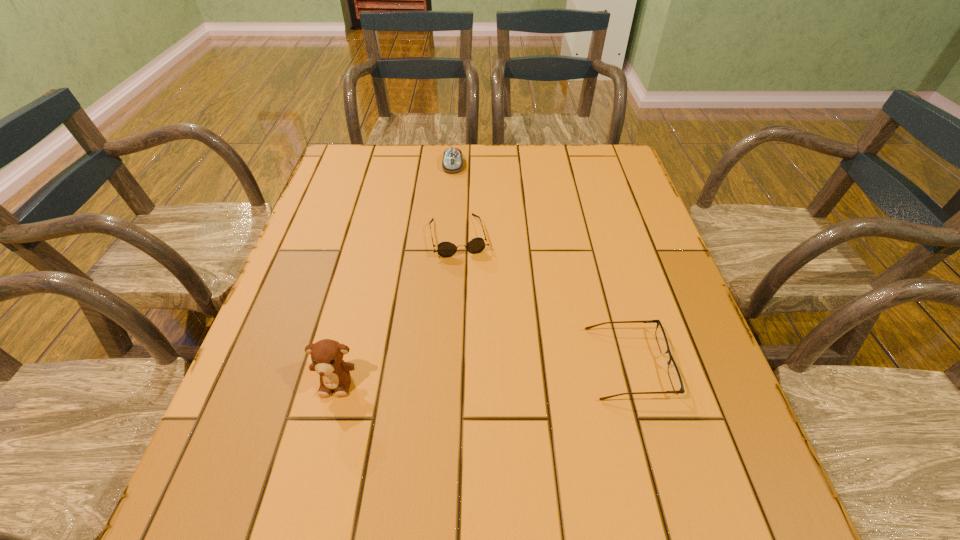
The width and height of the screenshot is (960, 540). I want to click on free space at the far right corner of the desktop, so click(x=587, y=186).

This screenshot has width=960, height=540. I want to click on free spot between the teddy bear and the sunglasses, so click(397, 309).

This screenshot has height=540, width=960. I want to click on empty space that is in between the spectacles and the sunglasses, so click(543, 300).

The width and height of the screenshot is (960, 540). Find the location of `free space between the farthest object and the teddy bear`. free space between the farthest object and the teddy bear is located at coordinates (395, 273).

The height and width of the screenshot is (540, 960). I want to click on empty space between the sunglasses and the computer mouse, so click(x=456, y=200).

Locate an element on the screen. free space between the farthest object and the third nearest object is located at coordinates (456, 200).

Where is `free area in between the rightmost object and the second farthest object`? This screenshot has height=540, width=960. free area in between the rightmost object and the second farthest object is located at coordinates (543, 300).

Locate an element on the screen. vacant area that lies between the computer mouse and the sunglasses is located at coordinates (456, 200).

The width and height of the screenshot is (960, 540). I want to click on free space between the sunglasses and the leftmost object, so click(397, 309).

The height and width of the screenshot is (540, 960). Identify the location of free spot between the spectacles and the third nearest object. (543, 300).